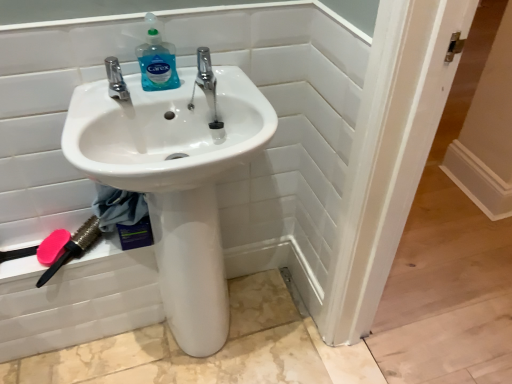
Locate an element on the screen. The width and height of the screenshot is (512, 384). vacant area that is situated to the right of polished chrome tap at upper left, which is the 2th tap from right to left is located at coordinates (184, 87).